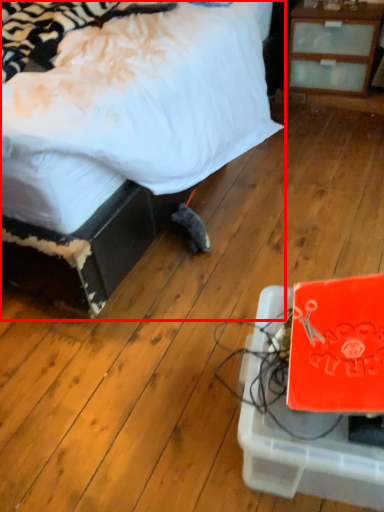
Question: From the image's perspective, where is bed (annotated by the red box) located relative to cardboard box?

Choices:
 (A) below
 (B) above

Answer: (B)